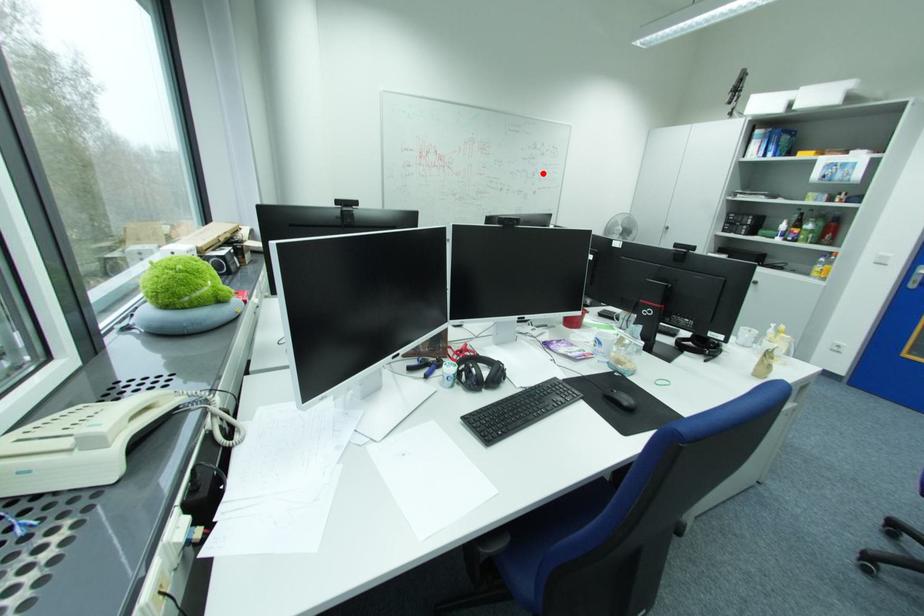
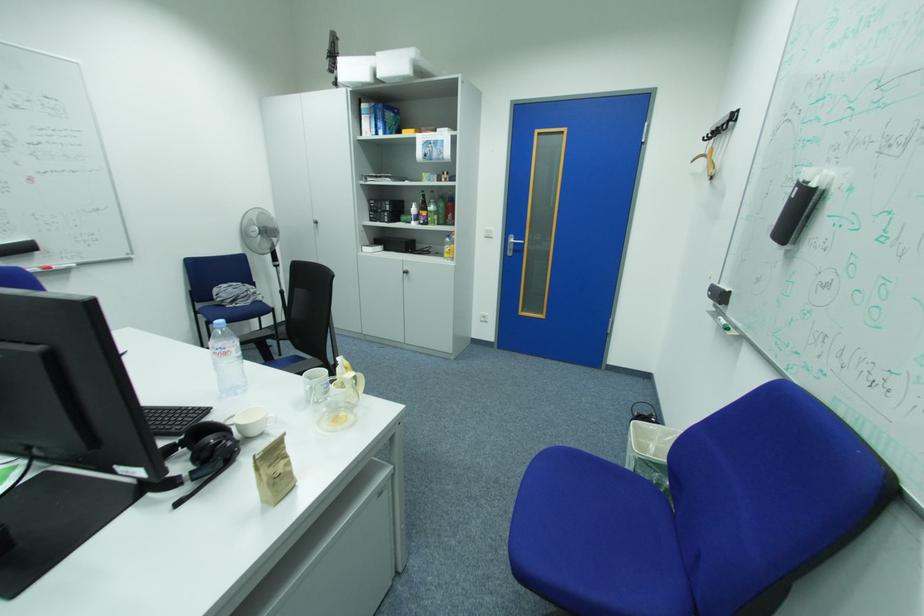
The point at the highlighted location is marked in the first image. Where is the corresponding point in the second image?

(14, 140)